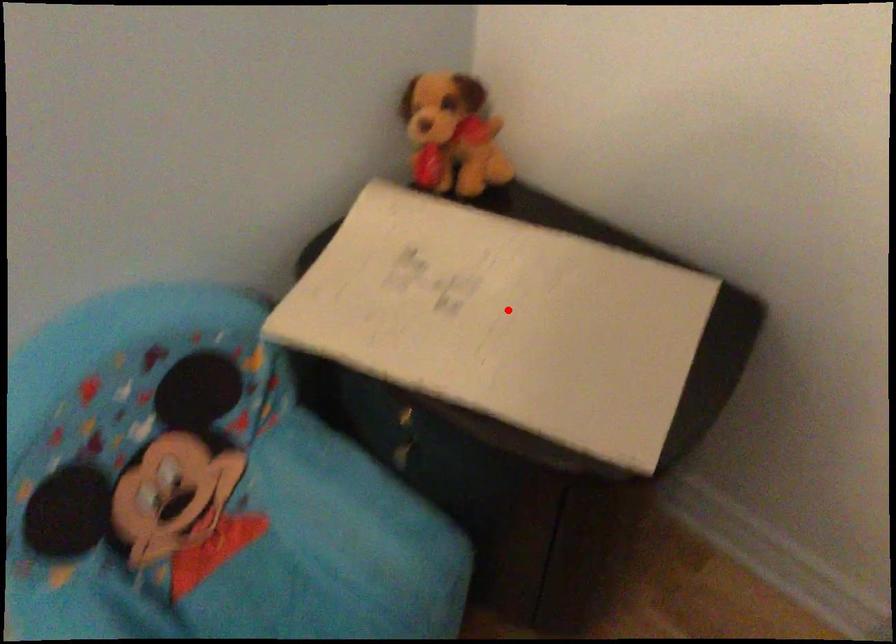
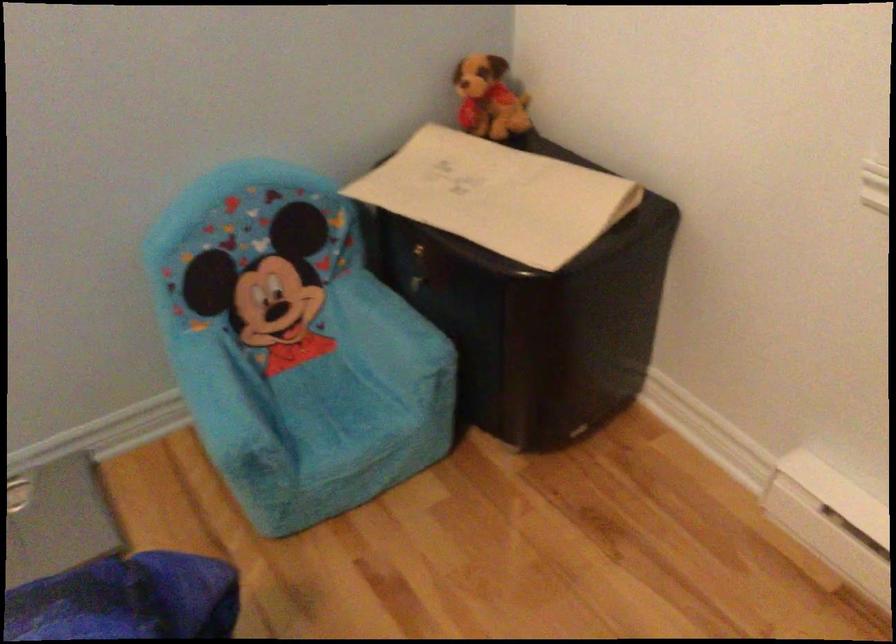
Question: I am providing you with two images of the same scene from different viewpoints. A red point is shown in image1. For the corresponding object point in image2, is it positioned nearer or farther from the camera?

Choices:
 (A) Nearer
 (B) Farther

Answer: (B)